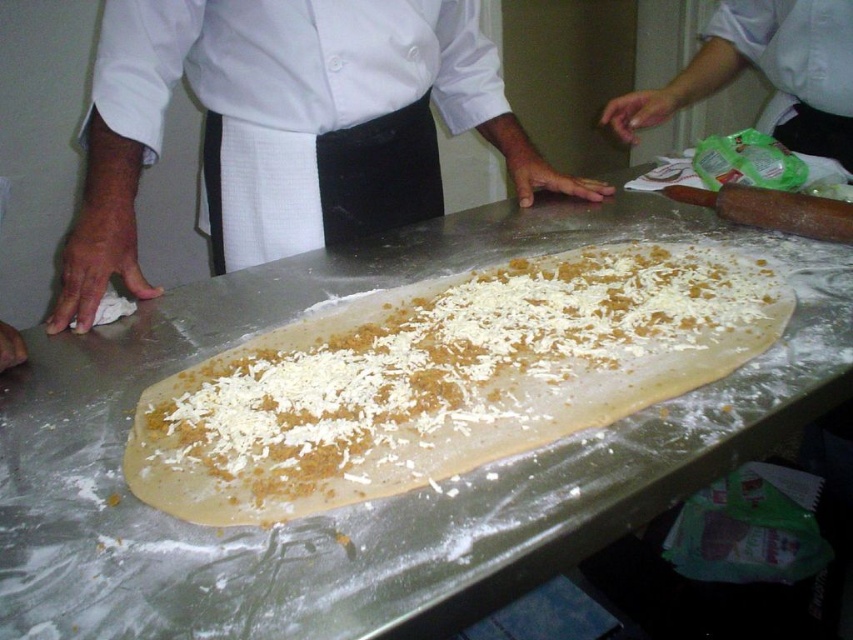
Question: Considering the relative positions of white crumbly dough at center and white fabric apron at center in the image provided, where is white crumbly dough at center located with respect to white fabric apron at center?

Choices:
 (A) above
 (B) below

Answer: (B)

Question: Can you confirm if white cloth at left is wider than white fabric apron at center?

Choices:
 (A) no
 (B) yes

Answer: (B)

Question: Among these points, which one is nearest to the camera?

Choices:
 (A) (772, 205)
 (B) (383, 227)
 (C) (509, 340)
 (D) (479, 122)

Answer: (C)

Question: Can you confirm if white cloth at left is positioned to the left of white fabric apron at center?

Choices:
 (A) no
 (B) yes

Answer: (B)

Question: Which object is positioned closest to the white crumbly dough at center?

Choices:
 (A) wooden rolling pin at right
 (B) white fabric apron at center

Answer: (B)

Question: Which of the following is the farthest from the observer?

Choices:
 (A) (511, 138)
 (B) (817, 225)
 (C) (277, 145)
 (D) (622, 253)

Answer: (A)